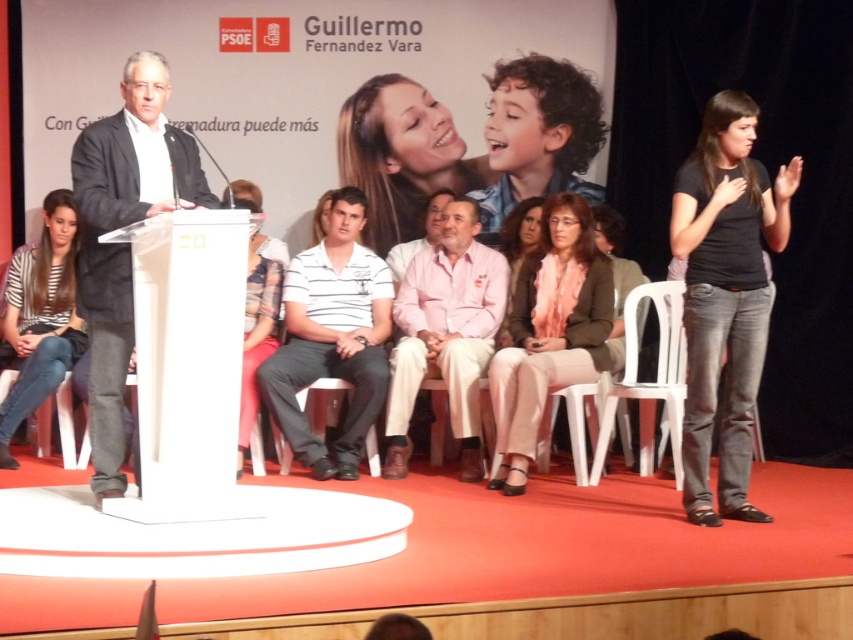
Does point (231, 196) come in front of point (332, 388)?

Yes, it is in front of point (332, 388).

At what (x,y) coordinates should I click in order to perform the action: click on striped fabric shirt at center. Please return your answer as a coordinate pair (x, y). Looking at the image, I should click on (257, 332).

Which is more to the left, black denim jeans at right or matte pink sweater at center?

matte pink sweater at center

Can you confirm if black denim jeans at right is positioned to the left of matte pink sweater at center?

No, black denim jeans at right is not to the left of matte pink sweater at center.

Does point (740, 310) come closer to viewer compared to point (531, 218)?

Yes, it is.

Locate an element on the screen. The image size is (853, 640). black denim jeans at right is located at coordinates (724, 296).

Is white striped shirt at center positioned before striped fabric shirt at center?

No.

Who is positioned more to the right, white striped shirt at center or striped fabric shirt at center?

From the viewer's perspective, white striped shirt at center appears more on the right side.

The width and height of the screenshot is (853, 640). Describe the element at coordinates (332, 337) in the screenshot. I see `white striped shirt at center` at that location.

Locate an element on the screen. This screenshot has width=853, height=640. white striped shirt at center is located at coordinates (332, 337).